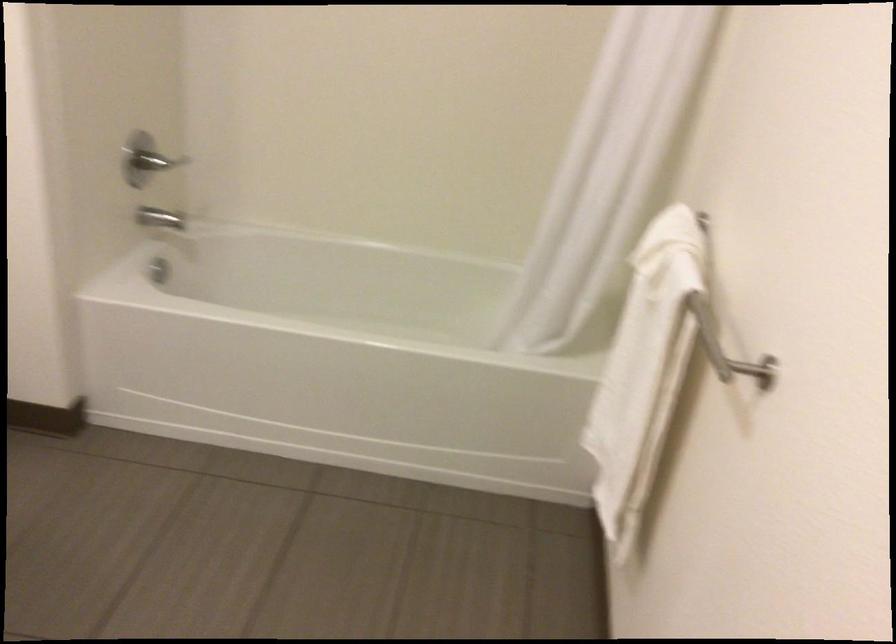
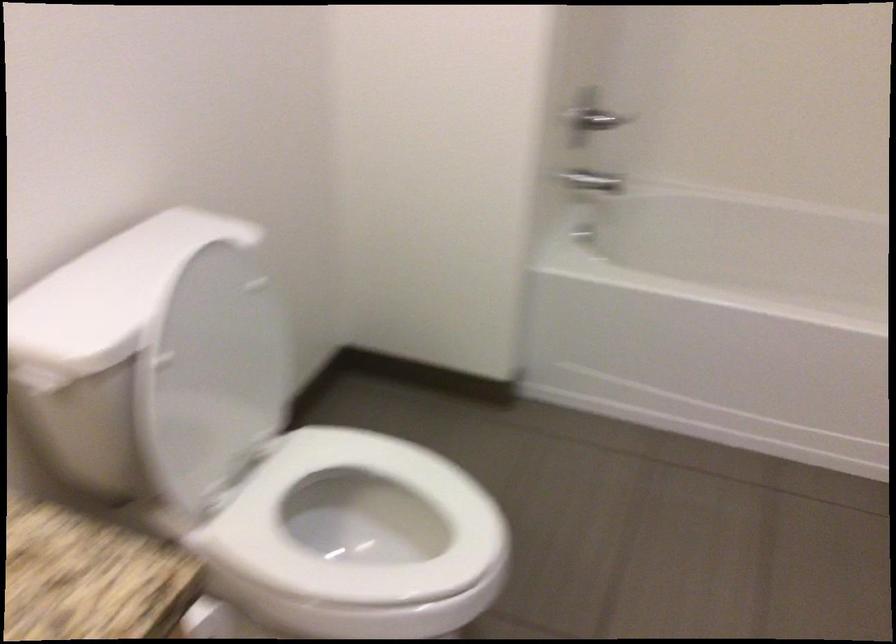
Question: Based on the continuous images, in which direction is the camera rotating? Reply with the corresponding letter.

Choices:
 (A) Left
 (B) Right
 (C) Up
 (D) Down

Answer: (A)